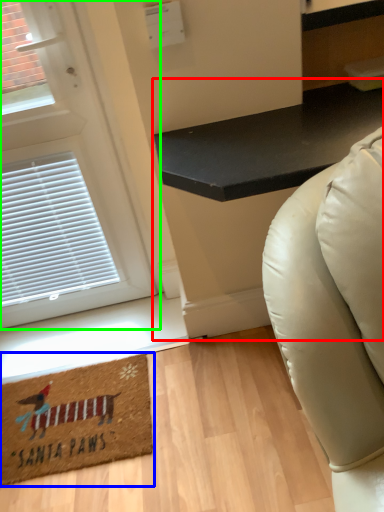
Question: Which object is positioned closest to table (highlighted by a red box)? Select from mat (highlighted by a blue box) and door (highlighted by a green box).

Choices:
 (A) mat
 (B) door

Answer: (B)